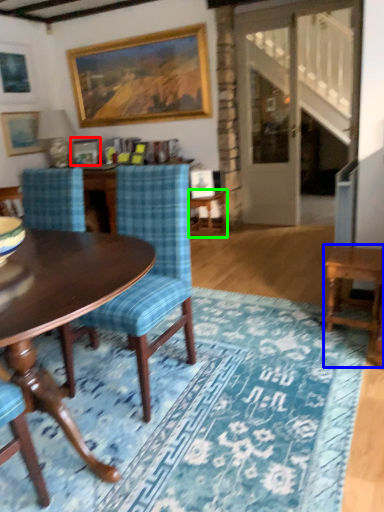
Question: Which object is positioned farthest from picture frame (highlighted by a red box)? Select from table (highlighted by a blue box) and side table (highlighted by a green box).

Choices:
 (A) table
 (B) side table

Answer: (A)